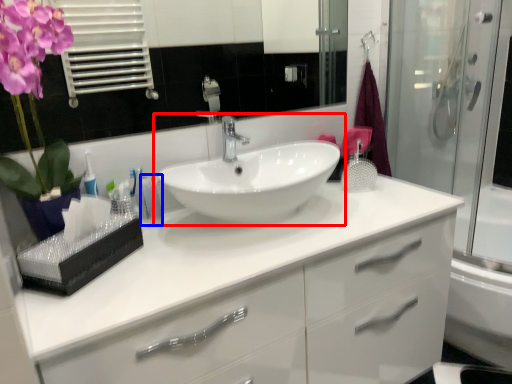
Question: Which point is closer to the camera, sink (highlighted by a red box) or toiletry (highlighted by a blue box)?

Choices:
 (A) sink
 (B) toiletry

Answer: (A)